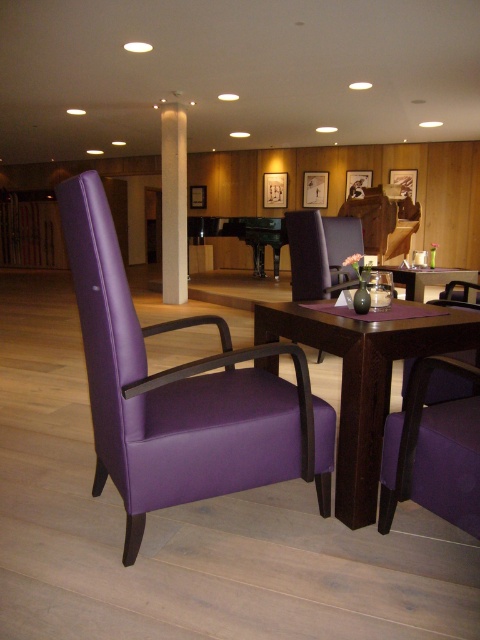
You are a guest in this hotel room and want to place a small plant on the dark wood table at center. However, you notice the white smooth pillar at center above it. Will the pillar block sunlight reaching the plant if placed there?

The dark wood table at center is below the white smooth pillar at center, so the pillar may block some sunlight from reaching the plant placed on the table.

You are a guest in this hotel lounge and want to sit in the purple leather armchair at left. However, there is a purple fabric chair at center blocking your path. Can you walk around it to reach the armchair?

The purple leather armchair at left is in front of the purple fabric chair at center, so you can walk around the purple fabric chair at center to reach the purple leather armchair at left.

You are standing at point (168, 182) and want to walk to the purple upholstered armchair in the foreground. Is point (117, 248) located in front of or behind your current position?

Point (117, 248) is in front of point (168, 182), so it is located in front of your current position.